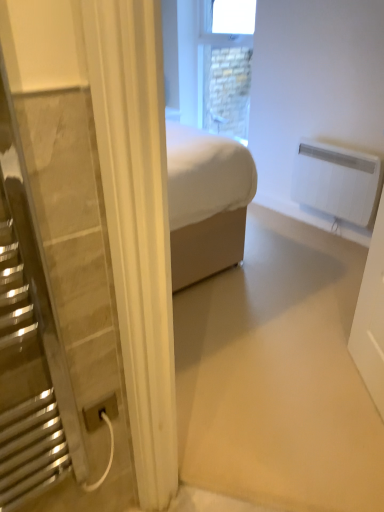
Where is `stone textured window at upper center`? The width and height of the screenshot is (384, 512). stone textured window at upper center is located at coordinates (225, 66).

The width and height of the screenshot is (384, 512). I want to click on radiator behind the white plastic power plug at lower left, so click(338, 181).

How many degrees apart are the facing directions of white plastic power plug at lower left and white plastic radiator at upper right?

There is a 90.9-degree angle between the facing directions of white plastic power plug at lower left and white plastic radiator at upper right.

Is white plastic power plug at lower left touching white plastic radiator at upper right?

No, white plastic power plug at lower left is not with white plastic radiator at upper right.

Do you think white plastic power plug at lower left is within white plastic radiator at upper right, or outside of it?

white plastic power plug at lower left is spatially situated outside white plastic radiator at upper right.

Which point is more forward, (224, 16) or (363, 216)?

Point (363, 216)

Is stone textured window at upper center to the left or to the right of white plastic radiator at upper right in the image?

Clearly, stone textured window at upper center is on the left of white plastic radiator at upper right in the image.

Is stone textured window at upper center bigger than white plastic radiator at upper right?

Yes.

Is stone textured window at upper center further to the viewer compared to white plastic radiator at upper right?

Yes, the depth of stone textured window at upper center is greater than that of white plastic radiator at upper right.

Does white plastic radiator at upper right have a greater height compared to stone textured window at upper center?

No, white plastic radiator at upper right is not taller than stone textured window at upper center.

How many degrees apart are the facing directions of white plastic radiator at upper right and stone textured window at upper center?

0.295 degrees separate the facing orientations of white plastic radiator at upper right and stone textured window at upper center.

From a real-world perspective, which object stands above the other?

In real-world perspective, stone textured window at upper center is above.

Considering the sizes of white plastic radiator at upper right and white plastic power plug at lower left in the image, is white plastic radiator at upper right bigger or smaller than white plastic power plug at lower left?

Clearly, white plastic radiator at upper right is larger in size than white plastic power plug at lower left.

Is white plastic radiator at upper right positioned beyond the bounds of white plastic power plug at lower left?

Yes.

Is white plastic radiator at upper right not near white plastic power plug at lower left?

white plastic radiator at upper right is far away from white plastic power plug at lower left.

How different are the orientations of white plastic radiator at upper right and white plastic power plug at lower left in degrees?

The facing directions of white plastic radiator at upper right and white plastic power plug at lower left are 90.9 degrees apart.

From a real-world perspective, between white plastic power plug at lower left and stone textured window at upper center, who is vertically higher?

stone textured window at upper center, from a real-world perspective.

From the image's perspective, which is above, white plastic power plug at lower left or stone textured window at upper center?

stone textured window at upper center, from the image's perspective.

Between white plastic power plug at lower left and stone textured window at upper center, which one has more height?

With more height is stone textured window at upper center.

Between white plastic power plug at lower left and stone textured window at upper center, which one has smaller size?

white plastic power plug at lower left.

Is stone textured window at upper center in front of or behind white plastic power plug at lower left in the image?

stone textured window at upper center is behind white plastic power plug at lower left.

From a real-world perspective, relative to white plastic power plug at lower left, is stone textured window at upper center vertically above or below?

stone textured window at upper center is situated higher than white plastic power plug at lower left in the real world.

Is stone textured window at upper center wider than white plastic power plug at lower left?

Yes.

Where is `power plugs and sockets above the white plastic radiator at upper right (from a real-world perspective)`? power plugs and sockets above the white plastic radiator at upper right (from a real-world perspective) is located at coordinates (100, 412).

I want to click on radiator on the right of stone textured window at upper center, so click(x=338, y=181).

Considering their positions, is white plastic radiator at upper right positioned further to stone textured window at upper center than white plastic power plug at lower left?

Based on the image, white plastic power plug at lower left appears to be further to stone textured window at upper center.

Estimate the real-world distances between objects in this image. Which object is further from stone textured window at upper center, white plastic power plug at lower left or white plastic radiator at upper right?

white plastic power plug at lower left is positioned further to the anchor stone textured window at upper center.

When comparing their distances from white plastic radiator at upper right, does stone textured window at upper center or white plastic power plug at lower left seem further?

white plastic power plug at lower left is further to white plastic radiator at upper right.

Based on their spatial positions, is white plastic radiator at upper right or stone textured window at upper center closer to white plastic power plug at lower left?

Among the two, white plastic radiator at upper right is located nearer to white plastic power plug at lower left.

From the image, which object appears to be nearer to white plastic power plug at lower left, stone textured window at upper center or white plastic radiator at upper right?

Among the two, white plastic radiator at upper right is located nearer to white plastic power plug at lower left.

When comparing their distances from white plastic radiator at upper right, does white plastic power plug at lower left or stone textured window at upper center seem closer?

Among the two, stone textured window at upper center is located nearer to white plastic radiator at upper right.

Identify the location of radiator between white plastic power plug at lower left and stone textured window at upper center in the front-back direction. (338, 181).